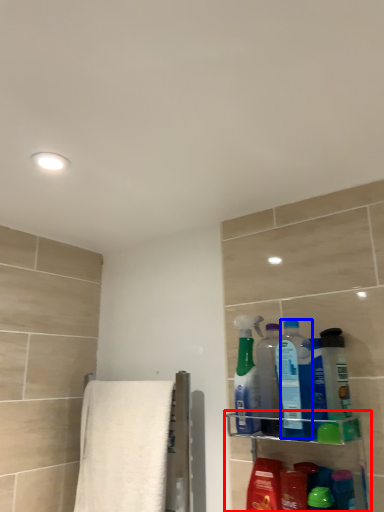
Question: Which point is closer to the camera, shelf (highlighted by a red box) or cleaning product (highlighted by a blue box)?

Choices:
 (A) shelf
 (B) cleaning product

Answer: (A)